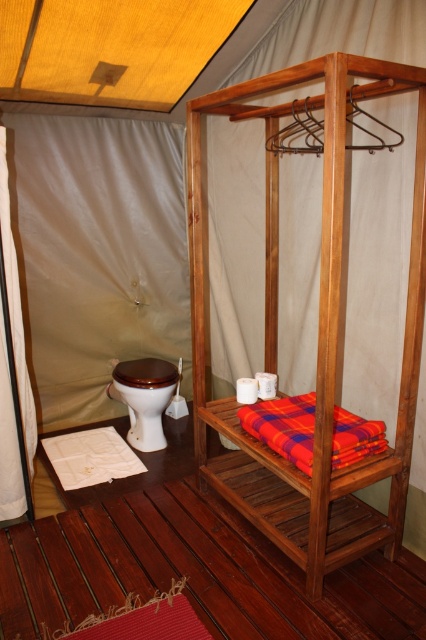
Is white fabric curtain at left further to camera compared to plaid fabric blanket at center?

Yes, white fabric curtain at left is behind plaid fabric blanket at center.

Who is higher up, white fabric curtain at left or plaid fabric blanket at center?

white fabric curtain at left is higher up.

At what (x,y) coordinates should I click in order to perform the action: click on white fabric curtain at left. Please return your answer as a coordinate pair (x, y). Looking at the image, I should click on (16, 314).

Find the location of a particular element. This screenshot has width=426, height=640. white fabric curtain at left is located at coordinates (16, 314).

Between point (377, 429) and point (132, 442), which one is positioned in front?

Point (377, 429) is in front.

Does plaid fabric blanket at center have a larger size compared to brown glossy toilet bowl at lower left?

No, plaid fabric blanket at center is not bigger than brown glossy toilet bowl at lower left.

Is point (293, 408) farther from viewer compared to point (129, 429)?

That is False.

Image resolution: width=426 pixels, height=640 pixels. In order to click on plaid fabric blanket at center in this screenshot , I will do pyautogui.click(x=284, y=426).

Can you confirm if white fabric curtain at left is bigger than brown glossy toilet bowl at lower left?

No, white fabric curtain at left is not bigger than brown glossy toilet bowl at lower left.

Can you confirm if white fabric curtain at left is positioned below brown glossy toilet bowl at lower left?

Incorrect, white fabric curtain at left is not positioned below brown glossy toilet bowl at lower left.

Where is `white fabric curtain at left`? The image size is (426, 640). white fabric curtain at left is located at coordinates click(x=16, y=314).